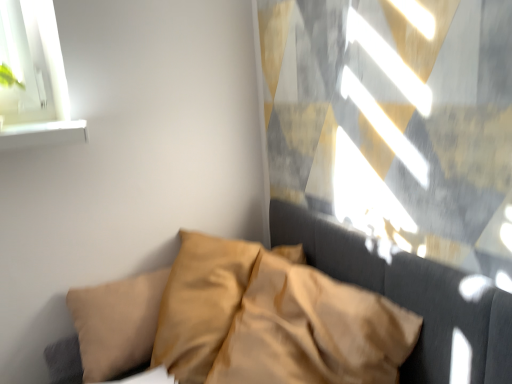
This screenshot has width=512, height=384. What do you see at coordinates (409, 296) in the screenshot?
I see `matte beige cushions at lower center` at bounding box center [409, 296].

At what (x,y) coordinates should I click in order to perform the action: click on matte beige cushions at lower center. Please return your answer as a coordinate pair (x, y). Image resolution: width=512 pixels, height=384 pixels. Looking at the image, I should click on (409, 296).

Find the location of a particular element. Image resolution: width=512 pixels, height=384 pixels. matte beige cushions at lower center is located at coordinates (409, 296).